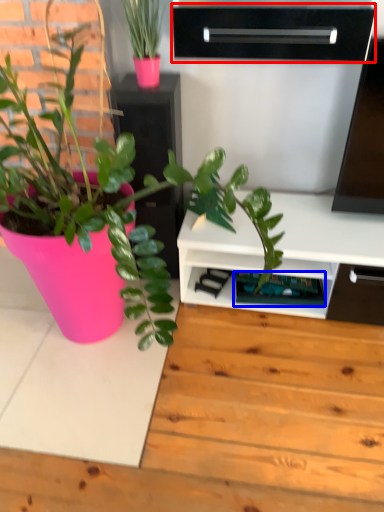
Question: Among these objects, which one is farthest to the camera, shelf (highlighted by a red box) or shelf (highlighted by a blue box)?

Choices:
 (A) shelf
 (B) shelf

Answer: (B)